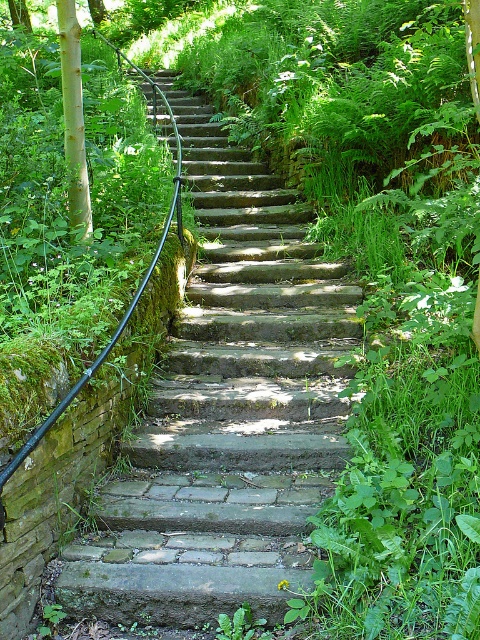
In the scene shown: You are a hiker trying to decide whether to climb the natural stone stairs at center or the smooth light brown tree trunk at left. Which one is taller?

The natural stone stairs at center is taller than the smooth light brown tree trunk at left, so you should choose the natural stone stairs at center if you want to climb something taller.

In the scene shown: You are a painter carrying a 1.2 meter long wooden ladder. You need to place it between the natural stone stairs at center and the smooth light brown tree trunk at left. Will the ladder fit in that space?

The distance between the natural stone stairs at center and the smooth light brown tree trunk at left is 1.12 meters. Since the ladder is 1.2 meters long, it will not fit in the space between them.

You are a delivery robot with a 1.2 meter wide package. You need to navigate through the natural stone stairs at center and the smooth light brown tree trunk at left. Which path can you take without the package getting stuck?

The natural stone stairs at center might be wider than smooth light brown tree trunk at left, so the delivery robot should take the natural stone stairs at center to avoid the package getting stuck.